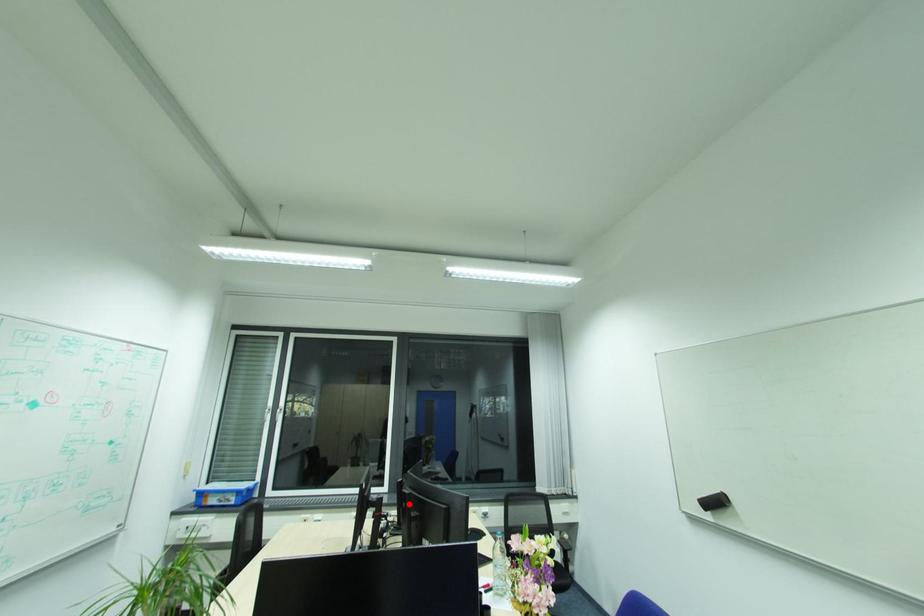
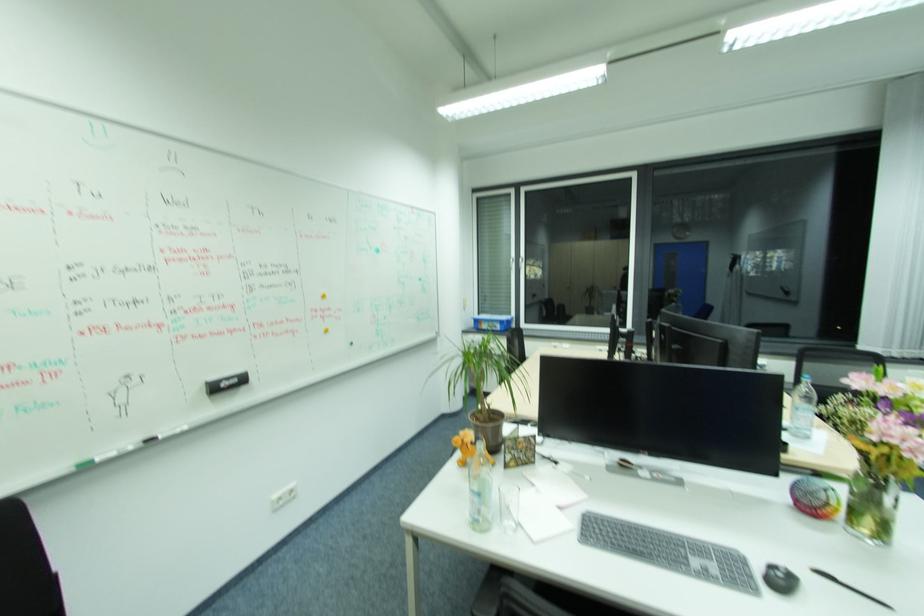
Find the pixel in the second image that matches the highlighted location in the first image.

(666, 334)